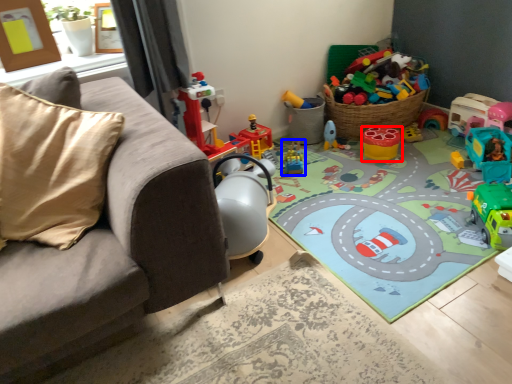
Question: Among these objects, which one is farthest to the camera, toy (highlighted by a red box) or toy (highlighted by a blue box)?

Choices:
 (A) toy
 (B) toy

Answer: (A)